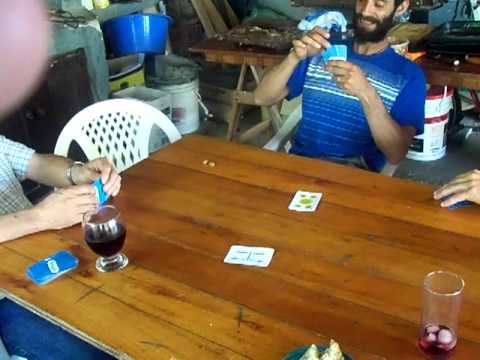
Locate an element on the screen. table is located at coordinates (338, 294).